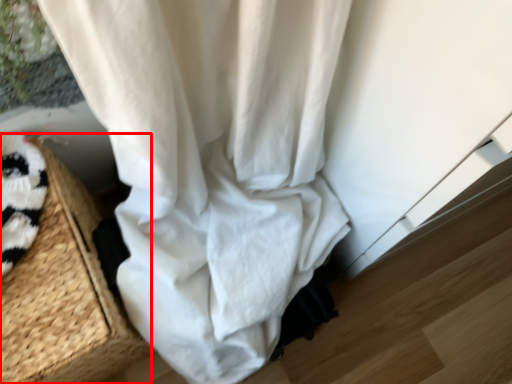
Question: From the image, what is the correct spatial relationship of basket (annotated by the red box) in relation to curtain?

Choices:
 (A) left
 (B) right

Answer: (A)